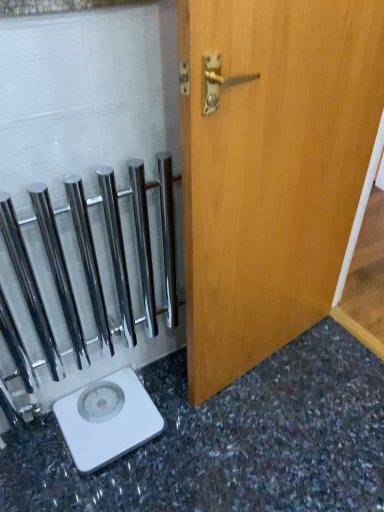
What do you see at coordinates (84, 203) in the screenshot? This screenshot has height=512, width=384. I see `polished chrome towel bars at left` at bounding box center [84, 203].

You are a GUI agent. You are given a task and a screenshot of the screen. Output one action in this format:
    pyautogui.click(x=<x>, y=<y>)
    Task: Click on the light brown wood door at center
    This screenshot has height=512, width=384.
    Given the screenshot: What is the action you would take?
    pyautogui.click(x=271, y=169)

Where is `granite gray surface at lower left`? This screenshot has height=512, width=384. granite gray surface at lower left is located at coordinates (230, 441).

Where is `polished chrome towel bars at left`? This screenshot has width=384, height=512. polished chrome towel bars at left is located at coordinates (x=84, y=203).

How many degrees apart are the facing directions of polished chrome towel bars at left and granite gray surface at lower left?

The angular difference between polished chrome towel bars at left and granite gray surface at lower left is 90.2 degrees.

Is point (36, 332) farther from viewer compared to point (252, 380)?

No, (36, 332) is closer to viewer.

Which of these two, polished chrome towel bars at left or granite gray surface at lower left, is wider?

With larger width is granite gray surface at lower left.

How different are the orientations of granite gray surface at lower left and light brown wood door at center in degrees?

granite gray surface at lower left and light brown wood door at center are facing 81.9 degrees away from each other.

Considering the sizes of granite gray surface at lower left and light brown wood door at center in the image, is granite gray surface at lower left wider or thinner than light brown wood door at center?

Considering their sizes, granite gray surface at lower left looks broader than light brown wood door at center.

Considering the relative sizes of granite gray surface at lower left and light brown wood door at center in the image provided, is granite gray surface at lower left bigger than light brown wood door at center?

No, granite gray surface at lower left is not bigger than light brown wood door at center.

Which object is further away from the camera, granite gray surface at lower left or light brown wood door at center?

Positioned behind is granite gray surface at lower left.

Is white plastic scale at lower left further to camera compared to polished chrome towel bars at left?

Yes, the depth of white plastic scale at lower left is greater than that of polished chrome towel bars at left.

Where is `glass door that appears in front of the white plastic scale at lower left`? glass door that appears in front of the white plastic scale at lower left is located at coordinates (84, 203).

From the image's perspective, who appears lower, white plastic scale at lower left or polished chrome towel bars at left?

white plastic scale at lower left is shown below in the image.

Does white plastic scale at lower left have a lesser height compared to polished chrome towel bars at left?

→ Indeed, white plastic scale at lower left has a lesser height compared to polished chrome towel bars at left.

From the image's perspective, between polished chrome towel bars at left and white plastic scale at lower left, who is located below?

white plastic scale at lower left is shown below in the image.

In the scene shown: Measure the distance from polished chrome towel bars at left to white plastic scale at lower left.

polished chrome towel bars at left and white plastic scale at lower left are 14.81 inches apart from each other.

Considering the positions of points (52, 268) and (65, 397), is point (52, 268) closer to camera compared to point (65, 397)?

Yes, it is.

Is white plastic scale at lower left further to camera compared to granite gray surface at lower left?

Yes, white plastic scale at lower left is further from the viewer.

What's the angular difference between white plastic scale at lower left and granite gray surface at lower left's facing directions?

The angle between the facing direction of white plastic scale at lower left and the facing direction of granite gray surface at lower left is 88.8 degrees.

Between white plastic scale at lower left and granite gray surface at lower left, which one has smaller width?

Thinner between the two is white plastic scale at lower left.

From a real-world perspective, which object stands above the other?

In real-world perspective, white plastic scale at lower left is above.

From the picture: Which object is thinner, polished chrome towel bars at left or light brown wood door at center?

With smaller width is polished chrome towel bars at left.

From a real-world perspective, between polished chrome towel bars at left and light brown wood door at center, who is vertically higher?

light brown wood door at center is physically above.

Which is in front, point (55, 213) or point (199, 246)?

The point (199, 246) is more forward.

Are light brown wood door at center and white plastic scale at lower left located far from each other?

That's not correct — light brown wood door at center is a little close to white plastic scale at lower left.

Is light brown wood door at center located outside white plastic scale at lower left?

light brown wood door at center is positioned outside white plastic scale at lower left.

From the image's perspective, between light brown wood door at center and white plastic scale at lower left, who is located below?

white plastic scale at lower left appears lower in the image.

Which is less distant, (x=383, y=67) or (x=136, y=395)?

Point (x=383, y=67) appears to be closer to the viewer than point (x=136, y=395).

Where is `granite in front of the polished chrome towel bars at left`? granite in front of the polished chrome towel bars at left is located at coordinates (230, 441).

Where is `granite that appears below the light brown wood door at center (from a real-world perspective)`? The image size is (384, 512). granite that appears below the light brown wood door at center (from a real-world perspective) is located at coordinates (230, 441).

Which object lies nearer to the anchor point light brown wood door at center, granite gray surface at lower left or polished chrome towel bars at left?

Based on the image, polished chrome towel bars at left appears to be nearer to light brown wood door at center.

Considering their positions, is white plastic scale at lower left positioned closer to granite gray surface at lower left than light brown wood door at center?

Based on the image, white plastic scale at lower left appears to be nearer to granite gray surface at lower left.

Based on the photo, when comparing their distances from light brown wood door at center, does polished chrome towel bars at left or granite gray surface at lower left seem further?

granite gray surface at lower left.

Estimate the real-world distances between objects in this image. Which object is closer to polished chrome towel bars at left, light brown wood door at center or white plastic scale at lower left?

Among the two, light brown wood door at center is located nearer to polished chrome towel bars at left.

When comparing their distances from white plastic scale at lower left, does granite gray surface at lower left or polished chrome towel bars at left seem closer?

granite gray surface at lower left.

When comparing their distances from light brown wood door at center, does polished chrome towel bars at left or white plastic scale at lower left seem further?

white plastic scale at lower left.

Estimate the real-world distances between objects in this image. Which object is closer to white plastic scale at lower left, polished chrome towel bars at left or light brown wood door at center?

Based on the image, polished chrome towel bars at left appears to be nearer to white plastic scale at lower left.

Considering their positions, is light brown wood door at center positioned closer to white plastic scale at lower left than granite gray surface at lower left?

granite gray surface at lower left.

The image size is (384, 512). In order to click on glass door that lies between light brown wood door at center and granite gray surface at lower left from top to bottom in this screenshot , I will do `click(84, 203)`.

This screenshot has width=384, height=512. What are the coordinates of `glass door between granite gray surface at lower left and white plastic scale at lower left in the front-back direction` in the screenshot? It's located at (84, 203).

This screenshot has width=384, height=512. In order to click on scale that lies between light brown wood door at center and granite gray surface at lower left from top to bottom in this screenshot , I will do `click(107, 420)`.

At what (x,y) coordinates should I click in order to perform the action: click on glass door between light brown wood door at center and white plastic scale at lower left in the up-down direction. Please return your answer as a coordinate pair (x, y). Looking at the image, I should click on (84, 203).